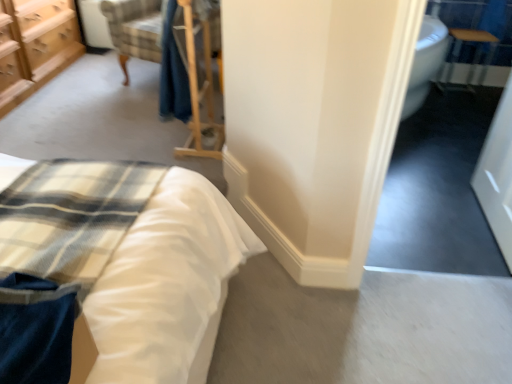
Image resolution: width=512 pixels, height=384 pixels. In order to click on vacant space behind white glossy door at right in this screenshot , I will do `click(439, 184)`.